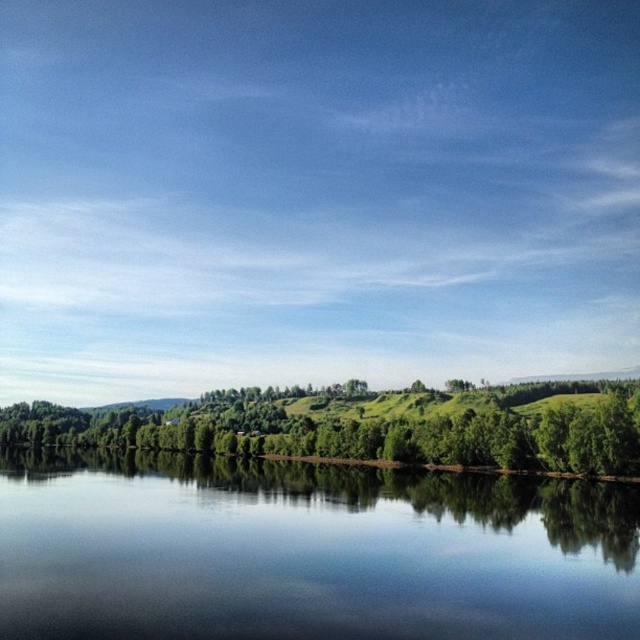
Does transparent water at center have a lesser width compared to green leafy trees at center?

Correct, transparent water at center's width is less than green leafy trees at center's.

Identify the location of transparent water at center. 307,552.

Image resolution: width=640 pixels, height=640 pixels. Find the location of `transparent water at center`. transparent water at center is located at coordinates (307, 552).